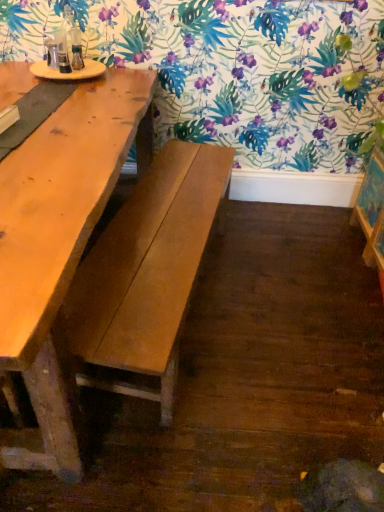
At what (x,y) coordinates should I click in order to perform the action: click on free spot above smooth wood bench at center (from a real-world perspective). Please return your answer as a coordinate pair (x, y). Looking at the image, I should click on (165, 213).